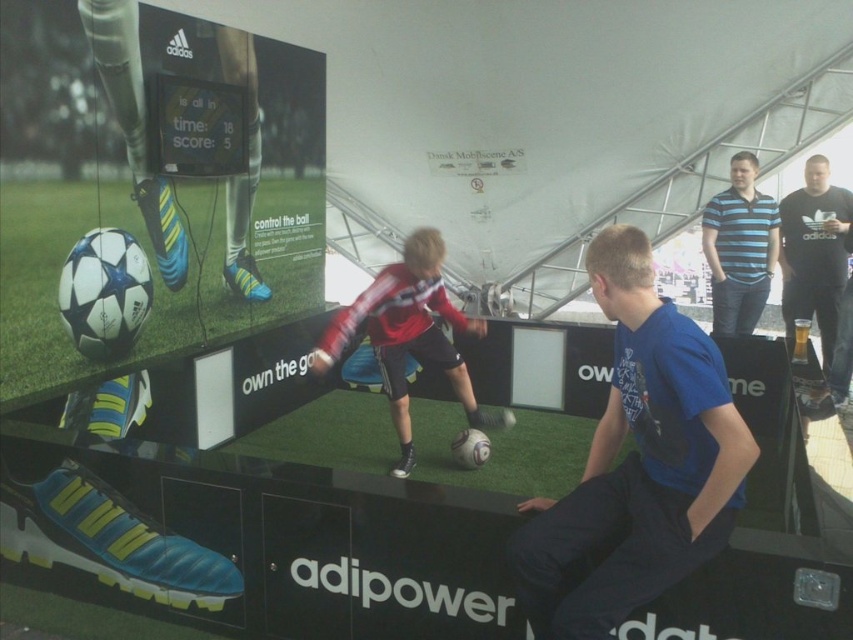
You are standing at the center of the soccer exhibit and want to take a photo that includes both the point at coordinates (459, 400) and the point at (834, 205). Based on their positions, which point will appear larger in the photo?

The point at coordinates (459, 400) will appear larger in the photo because it is closer to the camera than the point at (834, 205).

You are standing at the Adidas adipower exhibit and want to place a new display between the blue cotton shirt at center and the black cotton shirt at upper right. How far apart should you space them?

The blue cotton shirt at center is 13.37 feet away from the black cotton shirt at upper right, so you should space them 13.37 feet apart.